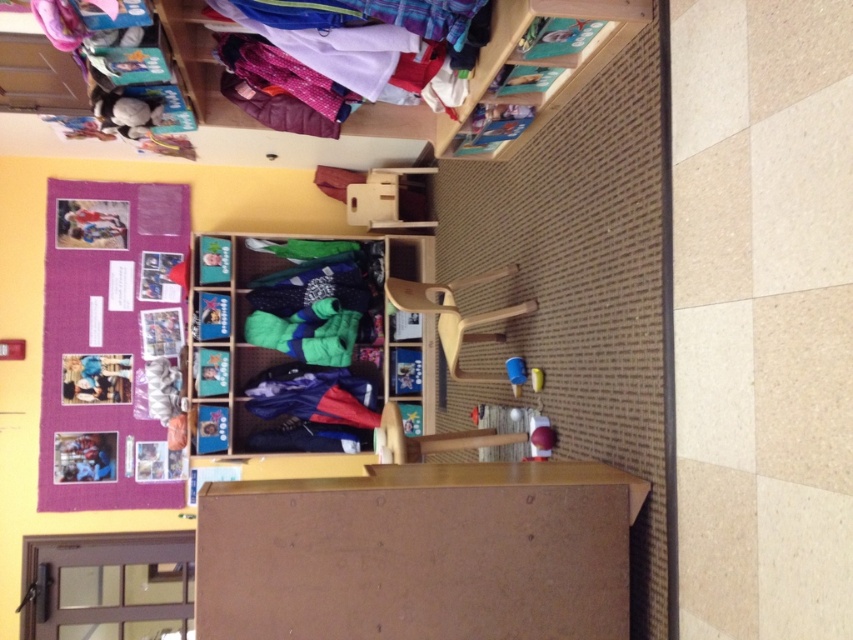
Question: Is soft fleece socks at center further to the viewer compared to shiny polyester jackets at upper center?

Choices:
 (A) yes
 (B) no

Answer: (A)

Question: Is purple fabric bulletin board at upper left above soft fleece socks at center?

Choices:
 (A) no
 (B) yes

Answer: (B)

Question: Based on their relative distances, which object is farther from the purple fabric bulletin board at upper left?

Choices:
 (A) soft fleece socks at center
 (B) shiny polyester jackets at upper center

Answer: (B)

Question: Which of the following is the closest to the observer?

Choices:
 (A) shiny polyester jackets at upper center
 (B) soft fleece socks at center
 (C) purple fabric bulletin board at upper left

Answer: (A)

Question: Which point is farther to the camera?

Choices:
 (A) (170, 456)
 (B) (347, 374)
 (C) (374, 35)

Answer: (B)

Question: Is soft fleece socks at center thinner than shiny polyester jackets at upper center?

Choices:
 (A) yes
 (B) no

Answer: (B)